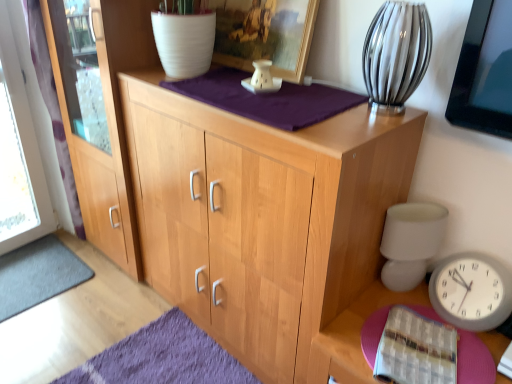
This screenshot has height=384, width=512. I want to click on vacant space situated above pink felt table at lower right (from a real-world perspective), so click(422, 344).